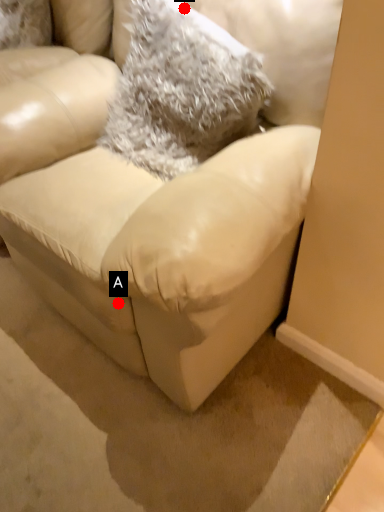
Question: Two points are circled on the image, labeled by A and B beside each circle. Which point appears closest to the camera in this image?

Choices:
 (A) A is closer
 (B) B is closer

Answer: (A)